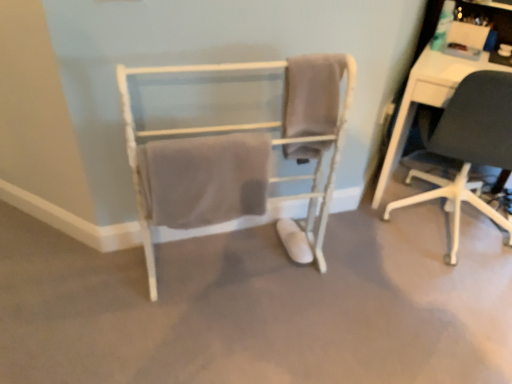
Question: From the image's perspective, is black matte chair at right, the 1th chair positioned from the right, positioned above or below beige cotton towel at center, arranged as the 1th bath towel when viewed from the left?

Choices:
 (A) above
 (B) below

Answer: (A)

Question: Do you think black matte chair at right, the 1th chair positioned from the right, is within beige cotton towel at center, which appears as the 2th bath towel when viewed from the right, or outside of it?

Choices:
 (A) inside
 (B) outside

Answer: (B)

Question: Estimate the real-world distances between objects in this image. Which object is farther from the beige cotton towel at center, arranged as the 1th bath towel when viewed from the left?

Choices:
 (A) white wood towel rack at center, which ranks as the 2th chair in right-to-left order
 (B) beige fabric towel at center, which is the first bath towel from right to left
 (C) black matte chair at right, the 1th chair positioned from the right

Answer: (C)

Question: Which is nearer to the beige fabric towel at center, which is the first bath towel from right to left?

Choices:
 (A) beige cotton towel at center, arranged as the 1th bath towel when viewed from the left
 (B) white wood towel rack at center, which ranks as the 2th chair in right-to-left order
 (C) black matte chair at right, the 2th chair viewed from the left

Answer: (B)